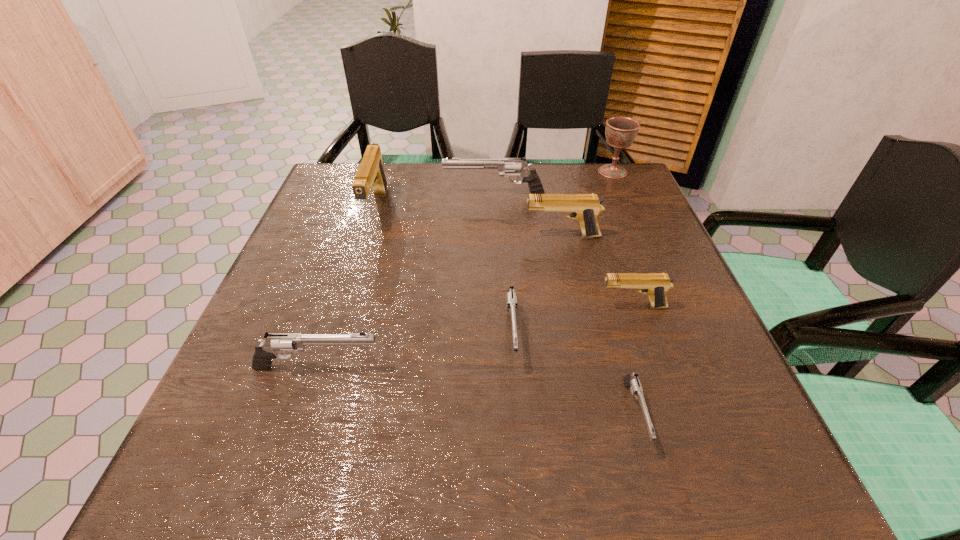
This screenshot has height=540, width=960. I want to click on the smallest silver pistol, so click(631, 380).

Where is `the shortest pistol`? the shortest pistol is located at coordinates (631, 380).

You are a GUI agent. You are given a task and a screenshot of the screen. Output one action in this format:
    pyautogui.click(x=<x>, y=<y>)
    Task: Click on the vacant space located on the left of the chalice
    The width and height of the screenshot is (960, 540).
    Given the screenshot: What is the action you would take?
    pyautogui.click(x=565, y=172)

This screenshot has width=960, height=540. Identify the location of vacant space located at the barrel of the leftmost tan pistol. (352, 289).

Locate an element on the screen. This screenshot has height=540, width=960. vacant region located 0.120m at the barrel of the second smallest tan pistol is located at coordinates (474, 236).

I want to click on vacant space located at the barrel of the second smallest tan pistol, so click(457, 236).

Find the location of `free spot located 0.310m at the barrel of the second smallest tan pistol`. free spot located 0.310m at the barrel of the second smallest tan pistol is located at coordinates (395, 236).

At what (x,y) coordinates should I click in order to perform the action: click on vacant position located on the front-facing side of the farthest silver pistol. Please return your answer as a coordinate pair (x, y). The image size is (960, 540). Looking at the image, I should click on (388, 194).

Image resolution: width=960 pixels, height=540 pixels. Find the location of `vacant space situated 0.090m on the front-facing side of the farthest silver pistol`. vacant space situated 0.090m on the front-facing side of the farthest silver pistol is located at coordinates (410, 194).

You are a GUI agent. You are given a task and a screenshot of the screen. Output one action in this format:
    pyautogui.click(x=<x>, y=<y>)
    Task: Click on the free space located on the front-facing side of the farthest silver pistol
    The height and width of the screenshot is (540, 960).
    Given the screenshot: What is the action you would take?
    pyautogui.click(x=366, y=194)